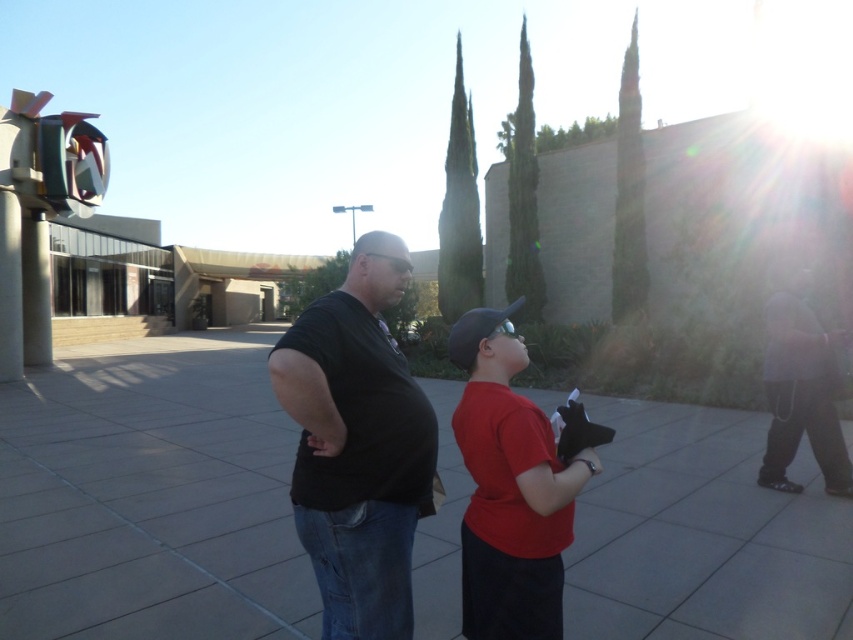
You are a photographer trying to capture a photo of the red matte shirt at center without including the gray concrete pavement at center. Based on their positions, is this possible?

The gray concrete pavement at center is positioned on the left side of red matte shirt at center. Since the gray concrete pavement is to the left of the red matte shirt, you can position yourself to the right side of the red matte shirt at center to frame the shot so that the gray concrete pavement at center is out of the frame.